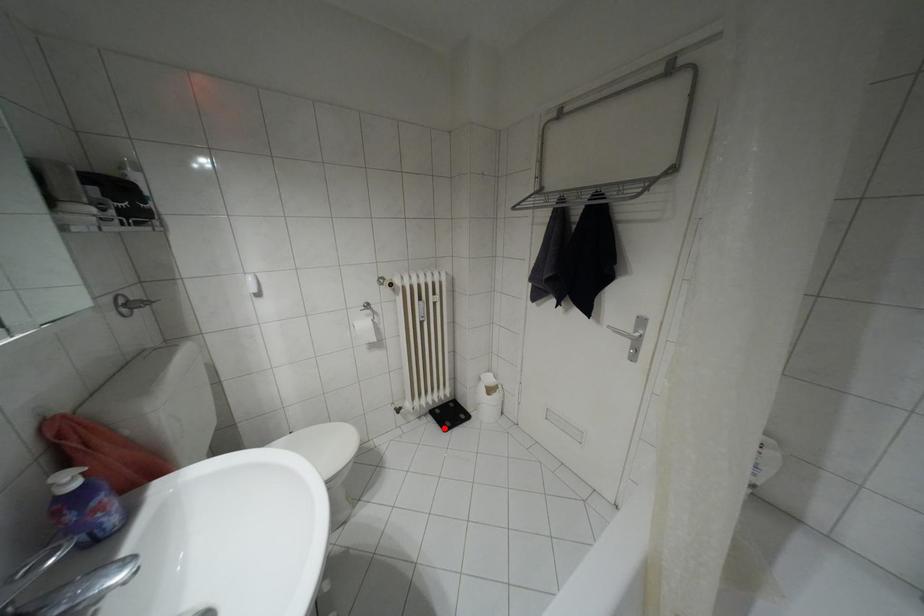
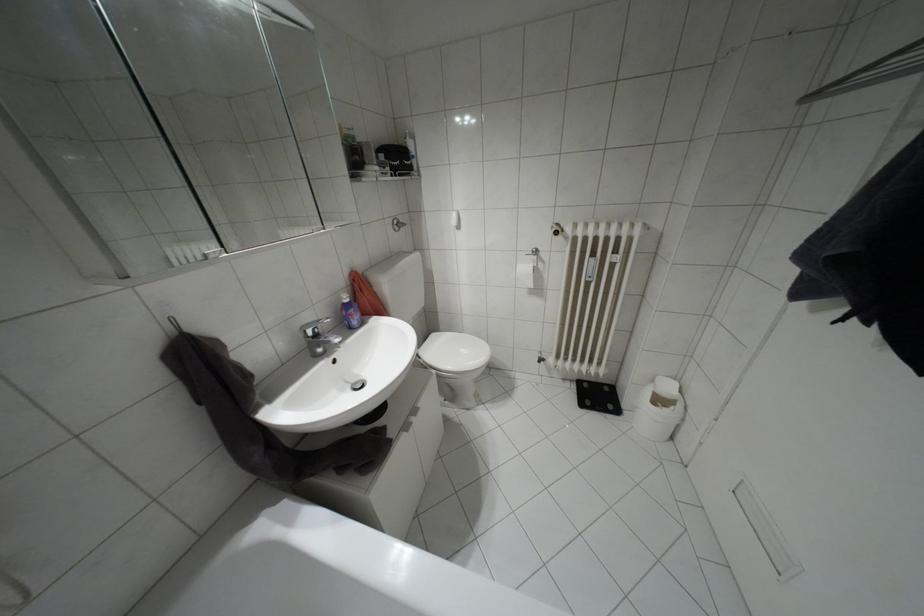
In the second image, find the point that corresponds to the highlighted location in the first image.

(580, 405)